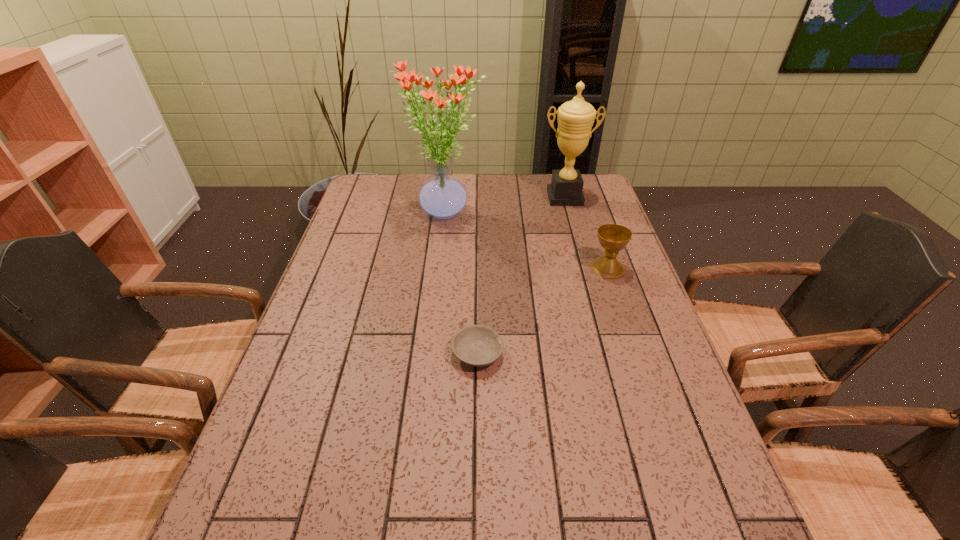
At what (x,y) coordinates should I click in order to perform the action: click on object that ranks as the closest to the trophy cup. Please return your answer as a coordinate pair (x, y). Looking at the image, I should click on (443, 197).

Identify the location of free space that satisfies the following two spatial constraints: 1. at the front of the trophy cup with handles; 2. on the right side of the chalice. This screenshot has width=960, height=540. (585, 268).

The width and height of the screenshot is (960, 540). In order to click on vacant region that satisfies the following two spatial constraints: 1. at the front of the third farthest object with handles; 2. on the left side of the third shortest object in this screenshot , I will do `click(585, 268)`.